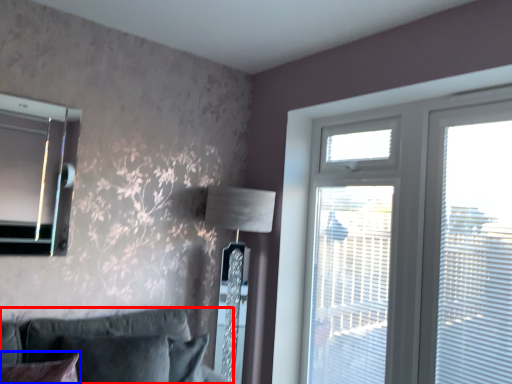
Question: Which point is further to the camera, studio couch (highlighted by a red box) or pillow (highlighted by a blue box)?

Choices:
 (A) studio couch
 (B) pillow

Answer: (A)